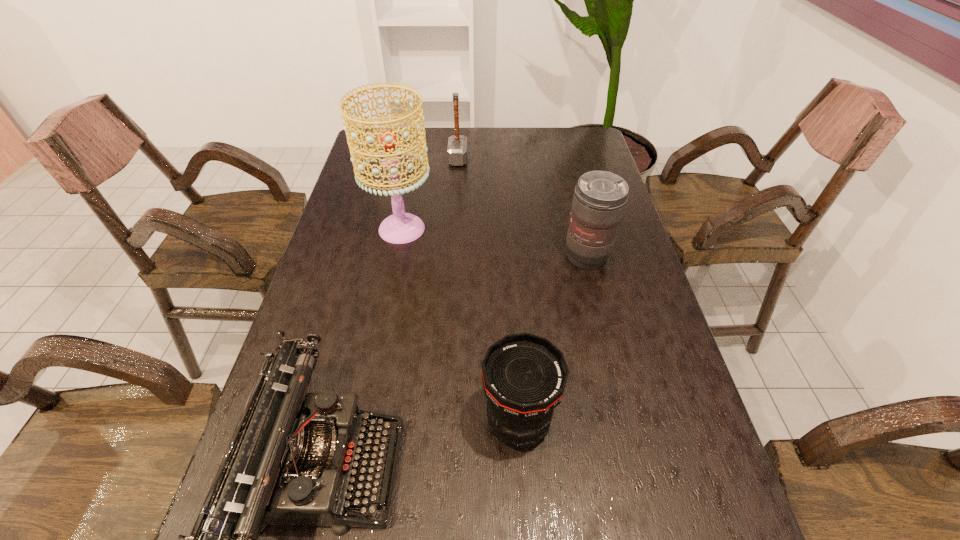
Locate an element on the screen. Image resolution: width=960 pixels, height=540 pixels. the tallest object is located at coordinates (400, 228).

Identify the location of the right telephoto lens. This screenshot has height=540, width=960. (600, 197).

You are a GUI agent. You are given a task and a screenshot of the screen. Output one action in this format:
    pyautogui.click(x=<x>, y=<y>)
    Task: Click on the taller telephoto lens
    
    Given the screenshot: What is the action you would take?
    pyautogui.click(x=600, y=197)

Where is `the farthest object`? The height and width of the screenshot is (540, 960). the farthest object is located at coordinates (457, 144).

The height and width of the screenshot is (540, 960). What are the coordinates of `hammer` in the screenshot? It's located at (457, 144).

The image size is (960, 540). In order to click on the fourth tallest object in this screenshot , I will do `click(524, 376)`.

Locate an element on the screen. the nearer telephoto lens is located at coordinates (524, 376).

Image resolution: width=960 pixels, height=540 pixels. Identify the location of vacant space located on the front of the tallest object. (378, 354).

You are a GUI agent. You are given a task and a screenshot of the screen. Output one action in this format:
    pyautogui.click(x=<x>, y=<y>)
    Task: Click on the vacant space situated on the side of the rightmost object where the control switches are located
    The image size is (960, 540).
    Given the screenshot: What is the action you would take?
    pyautogui.click(x=618, y=387)

Where is `blank area located on the striking surface of the third object from left to right`? blank area located on the striking surface of the third object from left to right is located at coordinates (512, 159).